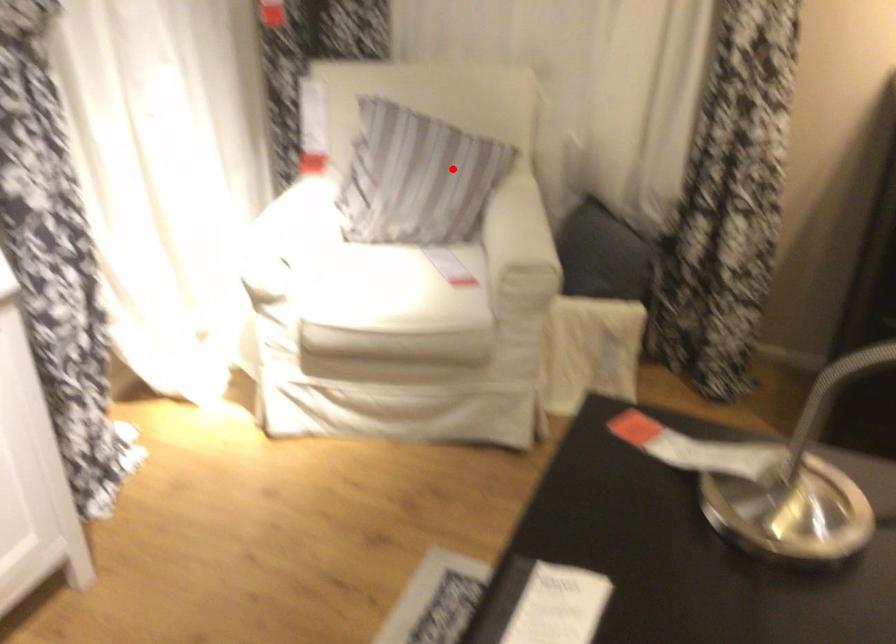
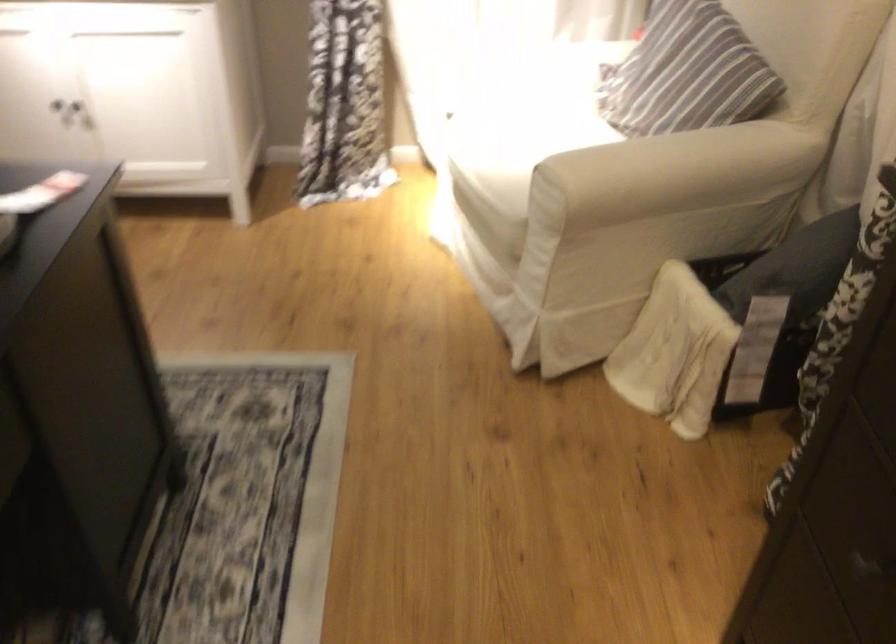
Question: I am providing you with two images of the same scene from different viewpoints. Image1 has a red point marked. In image2, the corresponding 3D location appears at what relative position? Reply with the corresponding letter.

Choices:
 (A) Closer
 (B) Farther

Answer: (A)